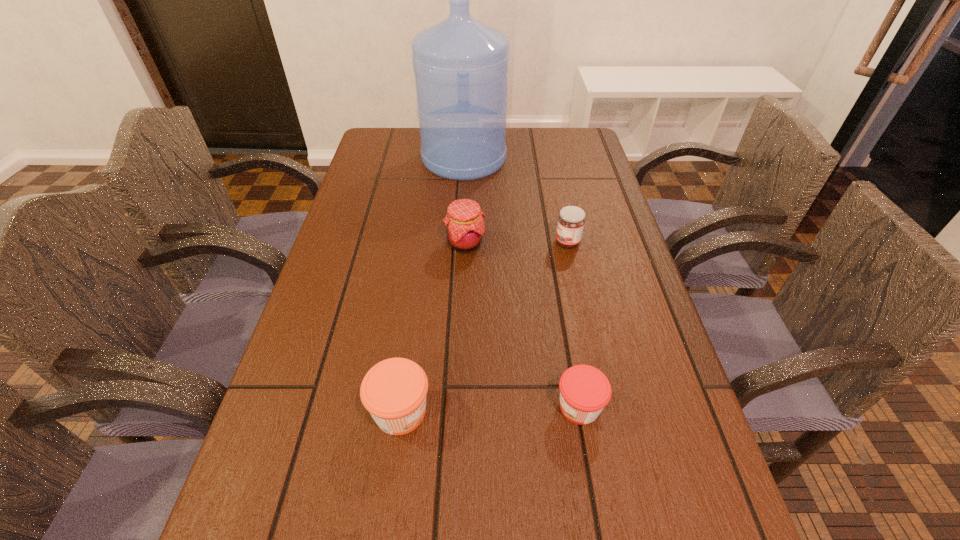
Locate an element on the screen. The image size is (960, 540). the tallest object is located at coordinates (461, 65).

At what (x,y) coordinates should I click in order to perform the action: click on water jug. Please return your answer as a coordinate pair (x, y). The image size is (960, 540). Looking at the image, I should click on (461, 65).

In order to click on the second tallest object in this screenshot , I will do `click(464, 223)`.

Find the location of a particular element. the shortest object is located at coordinates (584, 390).

Locate an element on the screen. This screenshot has height=540, width=960. free space located on the left of the tallest jam is located at coordinates (375, 244).

Find the location of `vacant space located on the label side of the shortest jam`. vacant space located on the label side of the shortest jam is located at coordinates (476, 407).

Image resolution: width=960 pixels, height=540 pixels. What are the coordinates of `vacant space situated 0.050m on the label side of the shortest jam` in the screenshot? It's located at (527, 407).

This screenshot has width=960, height=540. In order to click on free space located on the label side of the shortest jam in this screenshot , I will do `click(330, 407)`.

Where is `object that is at the far edge`? object that is at the far edge is located at coordinates (461, 65).

Where is `free space at the left edge`? This screenshot has height=540, width=960. free space at the left edge is located at coordinates (363, 221).